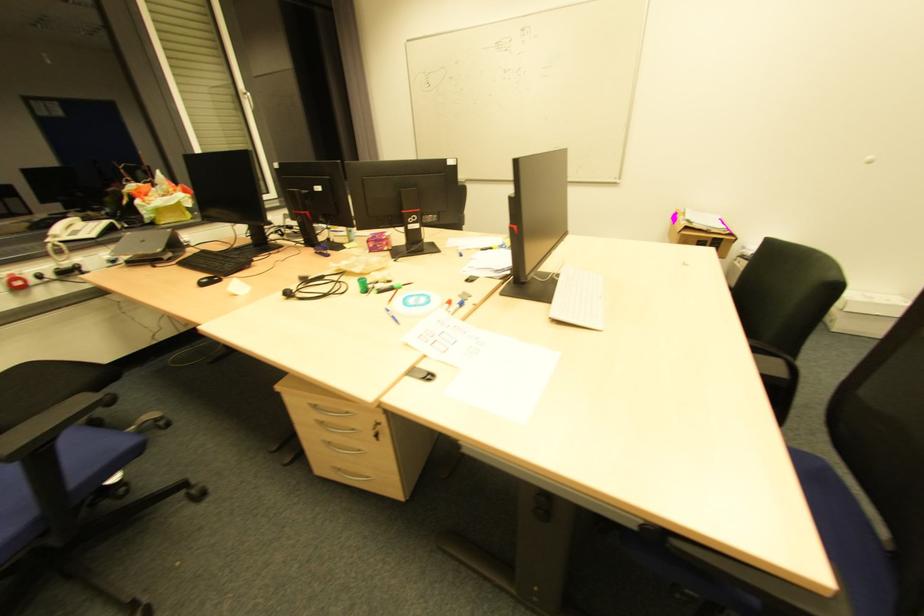
Where would you resting arm the black chair armrest? Please return your answer as a coordinate pair (x, y).

(769, 360)